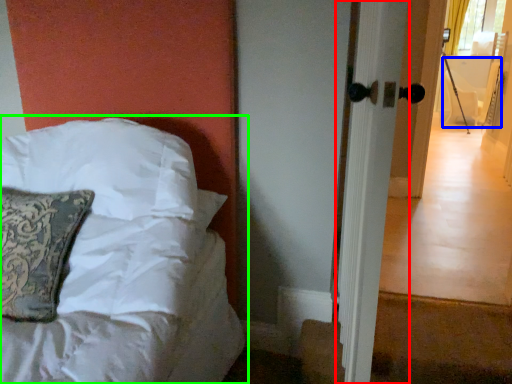
Question: Based on their relative distances, which object is nearer to screen door (highlighted by a red box)? Choose from armchair (highlighted by a blue box) and bed (highlighted by a green box).

Choices:
 (A) armchair
 (B) bed

Answer: (B)